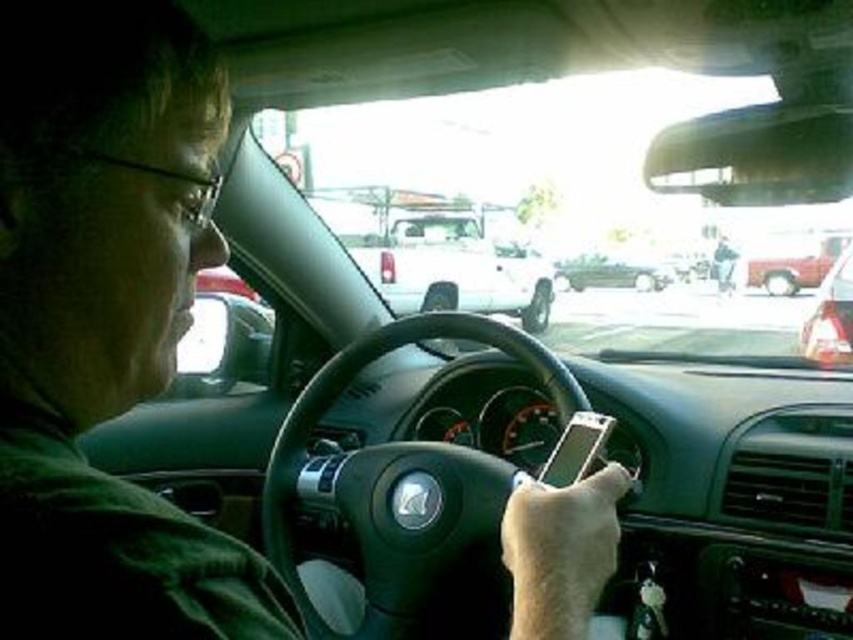
You are sitting in the passenger seat of a car and see the point at coordinates (451, 264). What object is located at that point?

The point at coordinates (451, 264) indicates a white matte truck at center.

You are a passenger in a car and want to know if you can easily reach the black leather steering wheel at center from your seat. Considering the size of the shiny black sedan at center, can you estimate whether the steering wheel is closer or farther from you?

The black leather steering wheel at center has a lesser width compared to the shiny black sedan at center, so the steering wheel is closer to you.

You are sitting in the passenger seat of the car and notice two black objects at the center of the image. Which one is closer to you, the black leather steering wheel at center or the shiny black sedan at center?

The black leather steering wheel at center is closer to the viewer than the shiny black sedan at center.